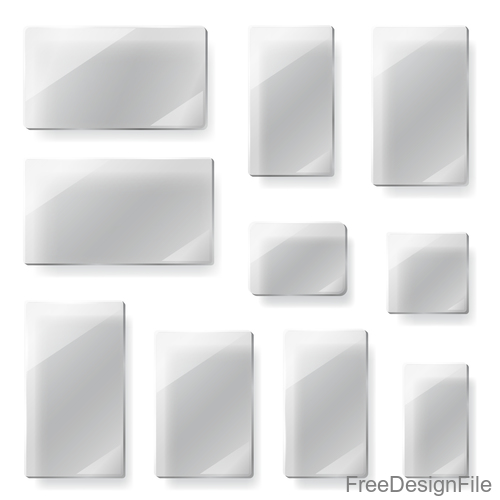
The height and width of the screenshot is (500, 500). What are the coordinates of `panel` in the screenshot? It's located at (120, 64), (292, 84), (434, 97), (143, 190), (283, 249), (449, 274), (70, 384), (193, 409), (337, 404), (439, 421).